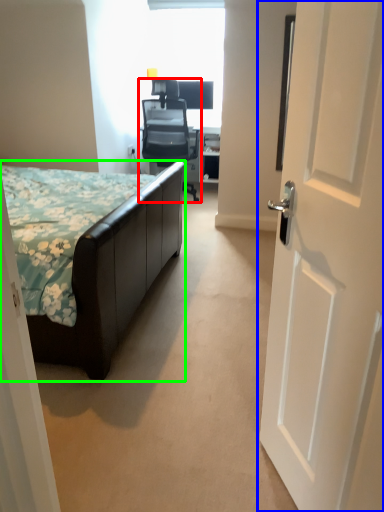
Question: Based on their relative distances, which object is nearer to chair (highlighted by a red box)? Choose from door (highlighted by a blue box) and bed (highlighted by a green box).

Choices:
 (A) door
 (B) bed

Answer: (B)